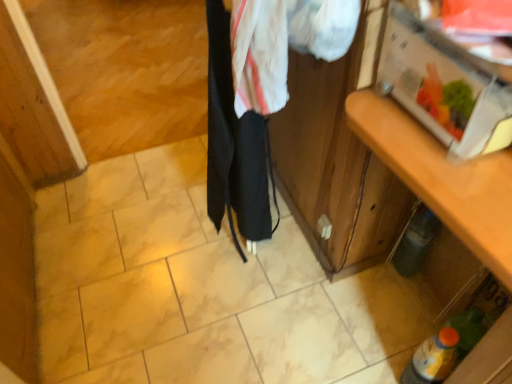
Question: From a real-world perspective, is green matte bottle at lower right, which is counted as the second bottle, starting from the bottom, above or below black fabric at center?

Choices:
 (A) above
 (B) below

Answer: (B)

Question: Considering the relative positions of green matte bottle at lower right, the 2th bottle when ordered from front to back, and black fabric at center in the image provided, is green matte bottle at lower right, the 2th bottle when ordered from front to back, to the left or to the right of black fabric at center?

Choices:
 (A) right
 (B) left

Answer: (A)

Question: Based on their relative distances, which object is nearer to the wooden cabinet at right?

Choices:
 (A) yellow-orange plastic bottle at lower right, placed as the 2th bottle when sorted from back to front
 (B) green matte bottle at lower right, which is the 1th bottle in back-to-front order
 (C) black fabric at center

Answer: (A)

Question: Which is farther from the wooden cabinet at right?

Choices:
 (A) green matte bottle at lower right, which is the 1th bottle in back-to-front order
 (B) black fabric at center
 (C) yellow-orange plastic bottle at lower right, which ranks as the 1th bottle in front-to-back order

Answer: (A)